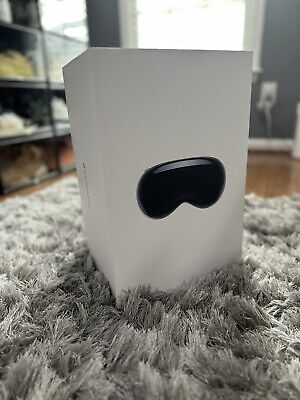
Image resolution: width=300 pixels, height=400 pixels. What are the coordinates of `shelving` in the screenshot? It's located at click(x=34, y=125), click(x=35, y=49), click(x=52, y=52).